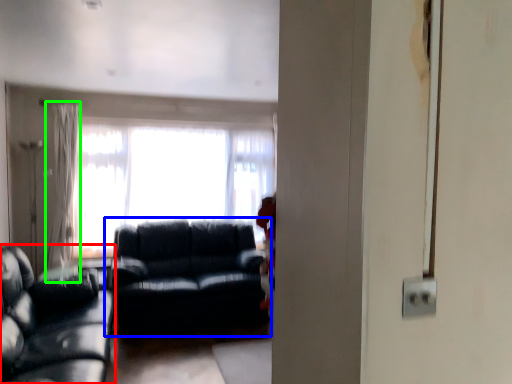
Question: Which object is the farthest from studio couch (highlighted by a red box)? Choose among these: studio couch (highlighted by a blue box) or curtain (highlighted by a green box).

Choices:
 (A) studio couch
 (B) curtain

Answer: (B)